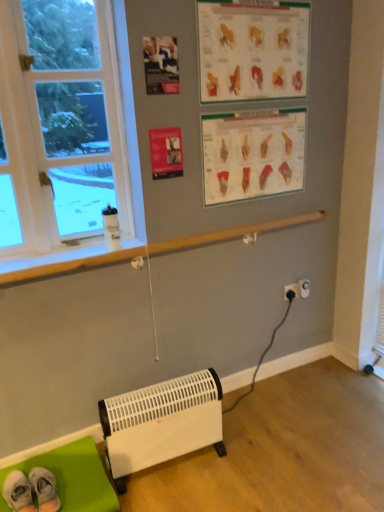
Where is `empty space that is ontop of green fabric mat at lower left`? empty space that is ontop of green fabric mat at lower left is located at coordinates (48, 486).